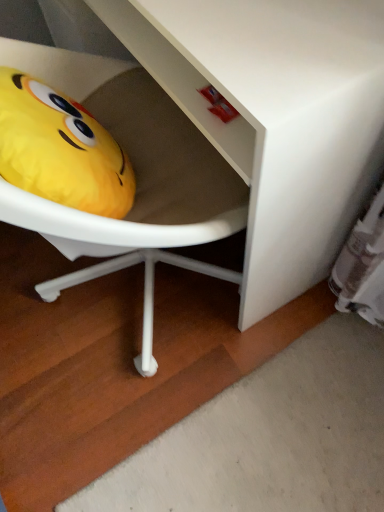
Question: Can white matte vanity at lower left be found inside yellow plush toy at left?

Choices:
 (A) no
 (B) yes

Answer: (A)

Question: Is yellow plush toy at left to the right of white matte vanity at lower left from the viewer's perspective?

Choices:
 (A) yes
 (B) no

Answer: (B)

Question: From the image's perspective, is yellow plush toy at left located beneath white matte vanity at lower left?

Choices:
 (A) no
 (B) yes

Answer: (B)

Question: Can you confirm if yellow plush toy at left is smaller than white matte vanity at lower left?

Choices:
 (A) no
 (B) yes

Answer: (B)

Question: Considering the relative sizes of yellow plush toy at left and white matte vanity at lower left in the image provided, is yellow plush toy at left shorter than white matte vanity at lower left?

Choices:
 (A) yes
 (B) no

Answer: (A)

Question: Is yellow plush toy at left to the left of white matte vanity at lower left from the viewer's perspective?

Choices:
 (A) yes
 (B) no

Answer: (A)

Question: Is white matte vanity at lower left positioned beyond the bounds of yellow plush toy at left?

Choices:
 (A) yes
 (B) no

Answer: (A)

Question: Can you confirm if white matte vanity at lower left is taller than yellow plush toy at left?

Choices:
 (A) no
 (B) yes

Answer: (B)

Question: From the image's perspective, is white matte vanity at lower left below yellow plush toy at left?

Choices:
 (A) no
 (B) yes

Answer: (A)

Question: Does white matte vanity at lower left have a lesser height compared to yellow plush toy at left?

Choices:
 (A) no
 (B) yes

Answer: (A)

Question: Is white matte vanity at lower left facing towards yellow plush toy at left?

Choices:
 (A) yes
 (B) no

Answer: (A)

Question: Is white matte vanity at lower left to the right of yellow plush toy at left from the viewer's perspective?

Choices:
 (A) no
 (B) yes

Answer: (B)

Question: From a real-world perspective, is white matte vanity at lower left above or below yellow plush toy at left?

Choices:
 (A) above
 (B) below

Answer: (B)